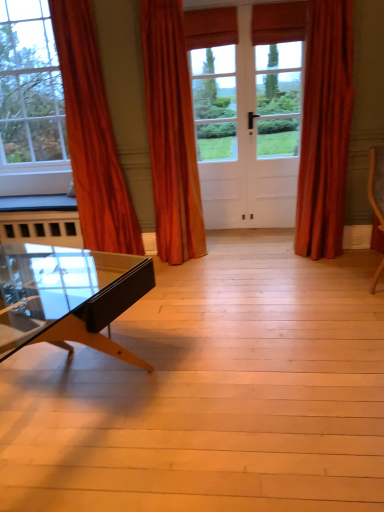
Question: Does orange velvet curtain at center, the 2th curtain positioned from the right, come in front of orange velvet curtain at left, the 3th curtain when ordered from right to left?

Choices:
 (A) yes
 (B) no

Answer: (B)

Question: Considering the relative positions of orange velvet curtain at center, which is the 2th curtain from left to right, and orange velvet curtain at left, the 1th curtain when ordered from left to right, in the image provided, is orange velvet curtain at center, which is the 2th curtain from left to right, behind orange velvet curtain at left, the 1th curtain when ordered from left to right,?

Choices:
 (A) yes
 (B) no

Answer: (A)

Question: Does orange velvet curtain at center, the 2th curtain positioned from the right, turn towards orange velvet curtain at left, the 1th curtain when ordered from left to right?

Choices:
 (A) no
 (B) yes

Answer: (A)

Question: Is orange velvet curtain at center, which is the 2th curtain from left to right, at the right side of orange velvet curtain at left, the 3th curtain when ordered from right to left?

Choices:
 (A) yes
 (B) no

Answer: (A)

Question: From a real-world perspective, is orange velvet curtain at center, which is the 2th curtain from left to right, under orange velvet curtain at left, the 3th curtain when ordered from right to left?

Choices:
 (A) yes
 (B) no

Answer: (A)

Question: Is velvet orange curtain at right, which is the 3th curtain in left-to-right order, to the left or to the right of orange velvet curtain at center, which is the 2th curtain from left to right, in the image?

Choices:
 (A) right
 (B) left

Answer: (A)

Question: Based on their sizes in the image, would you say velvet orange curtain at right, the 1th curtain in the right-to-left sequence, is bigger or smaller than orange velvet curtain at center, the 2th curtain positioned from the right?

Choices:
 (A) small
 (B) big

Answer: (A)

Question: Is velvet orange curtain at right, which is the 3th curtain in left-to-right order, wider or thinner than orange velvet curtain at center, which is the 2th curtain from left to right?

Choices:
 (A) thin
 (B) wide

Answer: (A)

Question: In terms of height, does velvet orange curtain at right, which is the 3th curtain in left-to-right order, look taller or shorter compared to orange velvet curtain at center, the 2th curtain positioned from the right?

Choices:
 (A) tall
 (B) short

Answer: (B)

Question: Do you think orange velvet curtain at left, the 3th curtain when ordered from right to left, is within velvet orange curtain at right, which is the 3th curtain in left-to-right order, or outside of it?

Choices:
 (A) outside
 (B) inside

Answer: (A)

Question: Is point (104, 132) closer or farther from the camera than point (317, 73)?

Choices:
 (A) farther
 (B) closer

Answer: (A)

Question: In terms of size, does orange velvet curtain at left, the 3th curtain when ordered from right to left, appear bigger or smaller than velvet orange curtain at right, the 1th curtain in the right-to-left sequence?

Choices:
 (A) small
 (B) big

Answer: (B)

Question: From a real-world perspective, is orange velvet curtain at left, the 3th curtain when ordered from right to left, above or below velvet orange curtain at right, which is the 3th curtain in left-to-right order?

Choices:
 (A) below
 (B) above

Answer: (B)

Question: From the image's perspective, is orange velvet curtain at left, the 3th curtain when ordered from right to left, positioned above or below orange velvet curtain at center, the 2th curtain positioned from the right?

Choices:
 (A) above
 (B) below

Answer: (B)

Question: Considering their positions, is orange velvet curtain at left, the 1th curtain when ordered from left to right, located in front of or behind orange velvet curtain at center, the 2th curtain positioned from the right?

Choices:
 (A) front
 (B) behind

Answer: (A)